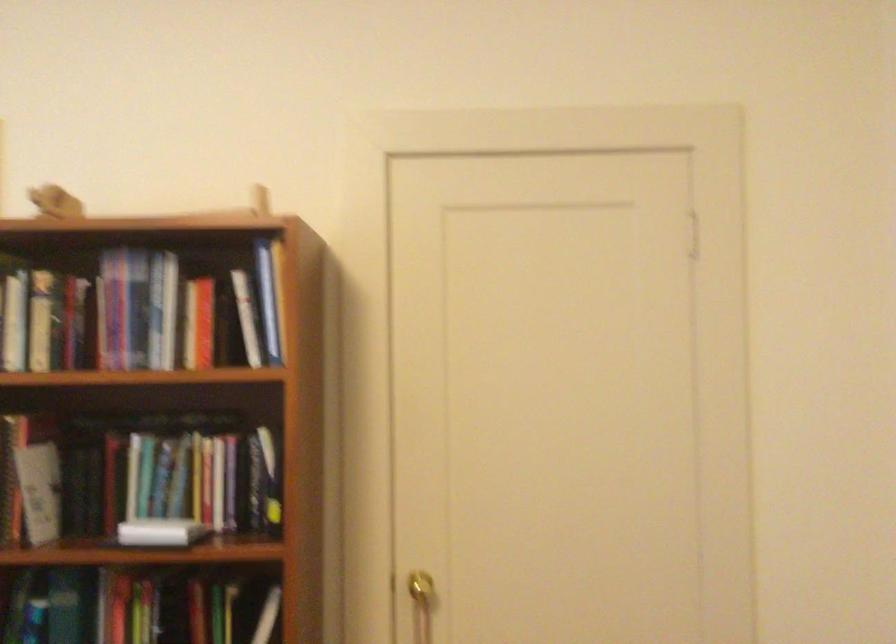
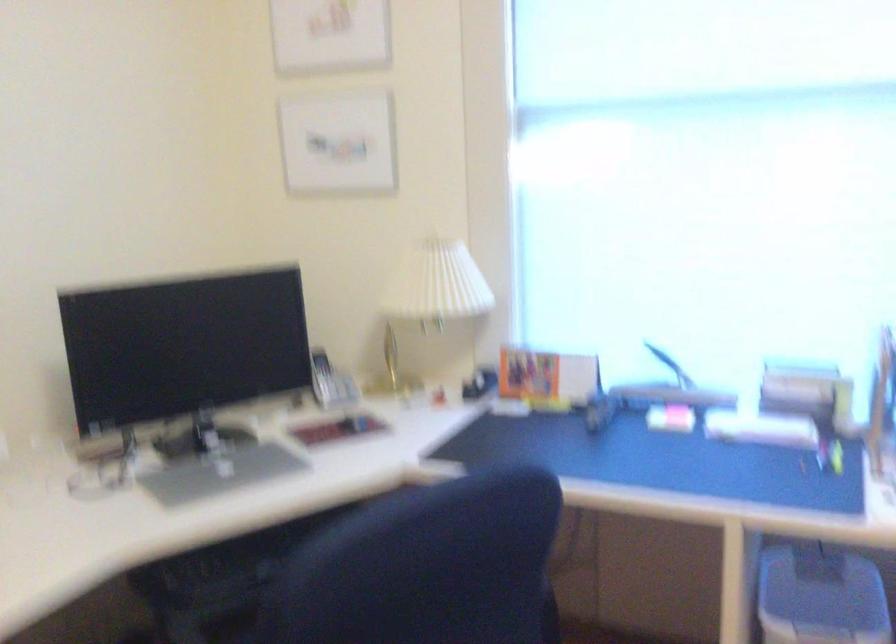
Question: How did the camera likely rotate?

Choices:
 (A) Left
 (B) Right
 (C) Up
 (D) Down

Answer: (A)